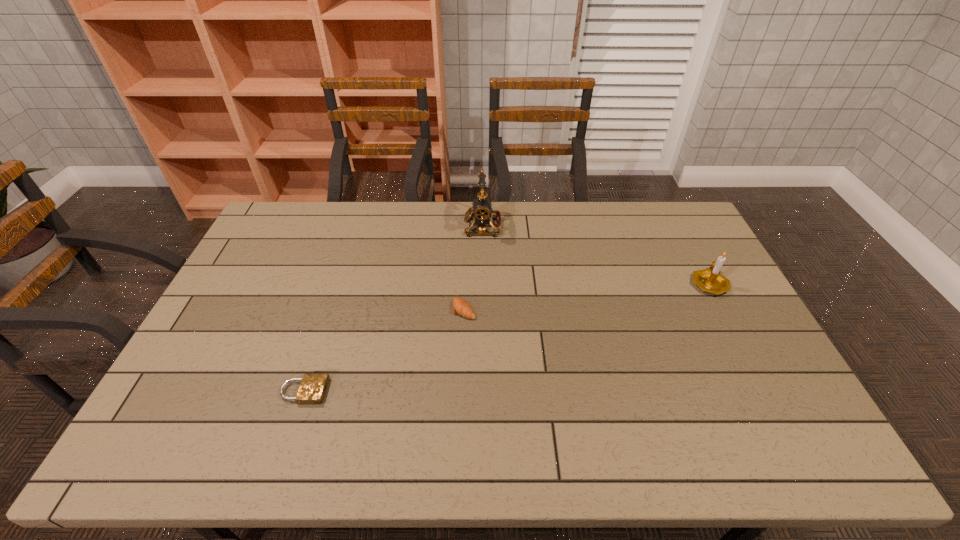
This screenshot has height=540, width=960. I want to click on vacant area that lies between the crescent roll and the leftmost object, so click(384, 350).

Locate an element on the screen. This screenshot has height=540, width=960. free spot between the telephone and the third shortest object is located at coordinates (596, 254).

Image resolution: width=960 pixels, height=540 pixels. In order to click on the closest object to the tallest object in this screenshot , I will do `click(461, 307)`.

The width and height of the screenshot is (960, 540). In order to click on object identified as the third closest to the third nearest object in this screenshot , I will do `click(312, 389)`.

At what (x,y) coordinates should I click in order to perform the action: click on free space that satisfies the following two spatial constraints: 1. on the front of the telephone, featuring the rotary dial; 2. on the front side of the third farthest object. Please return your answer as a coordinate pair (x, y). Looking at the image, I should click on (483, 309).

I want to click on vacant space that satisfies the following two spatial constraints: 1. on the front side of the crescent roll; 2. on the keyhole side of the shortest object, so click(x=461, y=391).

The height and width of the screenshot is (540, 960). I want to click on vacant space that satisfies the following two spatial constraints: 1. on the back side of the third shortest object; 2. on the left side of the third farthest object, so click(x=465, y=283).

I want to click on vacant space that satisfies the following two spatial constraints: 1. on the front of the tallest object, featuring the rotary dial; 2. on the front side of the third tallest object, so click(483, 309).

Identify the location of vacant region that satisfies the following two spatial constraints: 1. on the front of the telephone, featuring the rotary dial; 2. on the left side of the second tallest object. (483, 283).

Locate an element on the screen. free region that satisfies the following two spatial constraints: 1. on the front of the telephone, featuring the rotary dial; 2. on the back side of the rightmost object is located at coordinates (483, 283).